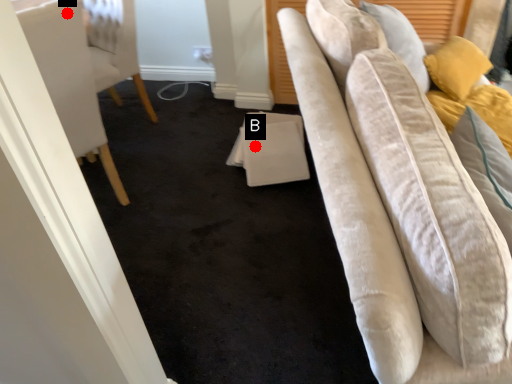
Question: Two points are circled on the image, labeled by A and B beside each circle. Which point is closer to the camera taking this photo?

Choices:
 (A) A is closer
 (B) B is closer

Answer: (A)